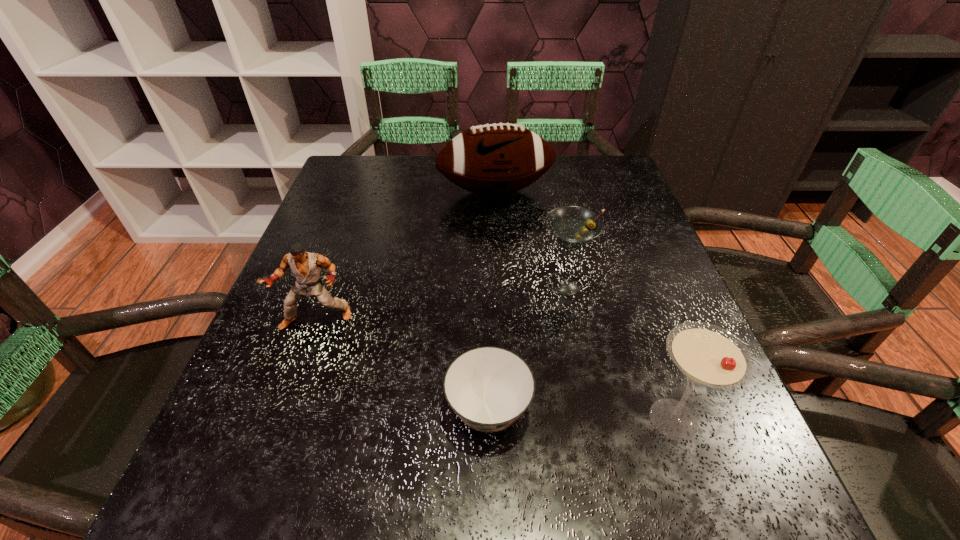
Image resolution: width=960 pixels, height=540 pixels. What are the coordinates of `empty space between the farther martini and the shortest object` in the screenshot? It's located at (526, 347).

Identify the location of vacant space that's between the rightmost object and the farthest object. (585, 305).

The height and width of the screenshot is (540, 960). Identify the location of vacant space that's between the rightmost object and the second farthest object. (618, 352).

Find the location of a particular element. Image resolution: width=960 pixels, height=540 pixels. free spot between the soup bowl and the third nearest object is located at coordinates (402, 364).

Where is `empty space between the shortest object and the left martini`? empty space between the shortest object and the left martini is located at coordinates (526, 347).

Find the location of a particular element. The image size is (960, 540). free spot between the left martini and the soup bowl is located at coordinates [x=526, y=347].

Find the location of `vacant space in between the shortest object and the left martini`. vacant space in between the shortest object and the left martini is located at coordinates (526, 347).

Where is `free space between the nearer martini and the farther martini`? This screenshot has height=540, width=960. free space between the nearer martini and the farther martini is located at coordinates (618, 352).

At what (x,y) coordinates should I click in order to perform the action: click on free space between the shortest object and the football (American). Please return your answer as a coordinate pair (x, y). This screenshot has width=960, height=540. Looking at the image, I should click on (492, 301).

This screenshot has width=960, height=540. In order to click on empty space between the right martini and the shortest object in this screenshot , I will do `click(581, 414)`.